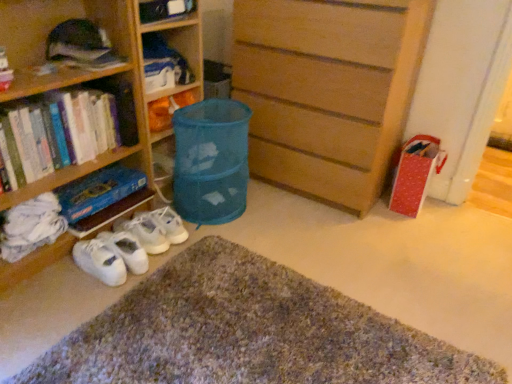
Find the location of a particular element. Image resolution: width=512 pixels, height=384 pixels. free space that is in between textured woolen doormat at lower center and white fabric sneakers at lower left is located at coordinates (76, 304).